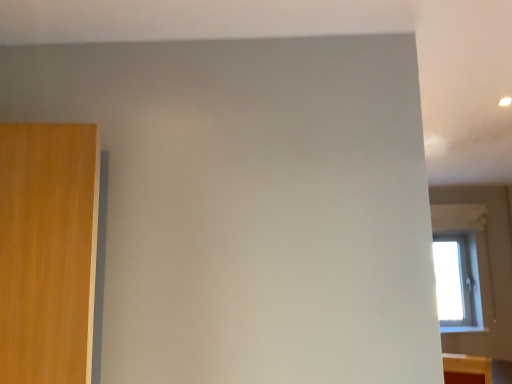
Where is `wooden bed frame at lower right`? wooden bed frame at lower right is located at coordinates (466, 369).

The height and width of the screenshot is (384, 512). What do you see at coordinates (466, 369) in the screenshot?
I see `wooden bed frame at lower right` at bounding box center [466, 369].

The image size is (512, 384). I want to click on wooden bed frame at lower right, so click(466, 369).